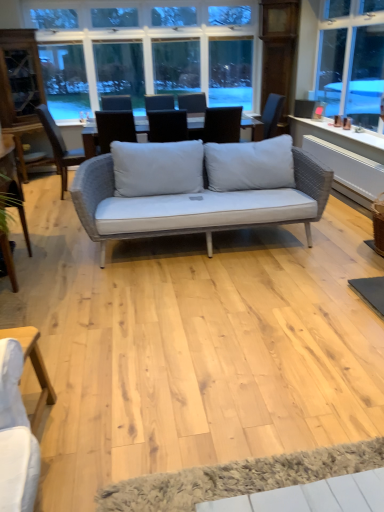
Question: Should I look upward or downward to see clear glass window at upper center?

Choices:
 (A) up
 (B) down

Answer: (A)

Question: Does woven fabric chair at center, which is counted as the first chair, starting from the left, have a greater height compared to matte gray cushion at center, arranged as the 1th chair when viewed from the right?

Choices:
 (A) no
 (B) yes

Answer: (B)

Question: Can you confirm if woven fabric chair at center, which is counted as the first chair, starting from the left, is wider than matte gray cushion at center, the 2th chair viewed from the left?

Choices:
 (A) yes
 (B) no

Answer: (A)

Question: Is woven fabric chair at center, positioned as the second chair in right-to-left order, thinner than matte gray cushion at center, arranged as the 1th chair when viewed from the right?

Choices:
 (A) no
 (B) yes

Answer: (A)

Question: Can you confirm if woven fabric chair at center, which is counted as the first chair, starting from the left, is shorter than matte gray cushion at center, the 2th chair viewed from the left?

Choices:
 (A) no
 (B) yes

Answer: (A)

Question: Considering the relative positions of woven fabric chair at center, which is counted as the first chair, starting from the left, and matte gray cushion at center, arranged as the 1th chair when viewed from the right, in the image provided, is woven fabric chair at center, which is counted as the first chair, starting from the left, to the right of matte gray cushion at center, arranged as the 1th chair when viewed from the right, from the viewer's perspective?

Choices:
 (A) no
 (B) yes

Answer: (A)

Question: Is woven fabric chair at center, positioned as the second chair in right-to-left order, completely or partially outside of matte gray cushion at center, arranged as the 1th chair when viewed from the right?

Choices:
 (A) no
 (B) yes

Answer: (B)

Question: From a real-world perspective, is woven fabric chair at center, positioned as the second chair in right-to-left order, located higher than light wood table at lower left?

Choices:
 (A) yes
 (B) no

Answer: (A)

Question: Can you confirm if woven fabric chair at center, which is counted as the first chair, starting from the left, is smaller than light wood table at lower left?

Choices:
 (A) yes
 (B) no

Answer: (B)

Question: Does woven fabric chair at center, positioned as the second chair in right-to-left order, appear on the right side of light wood table at lower left?

Choices:
 (A) no
 (B) yes

Answer: (A)

Question: Is woven fabric chair at center, positioned as the second chair in right-to-left order, aimed at light wood table at lower left?

Choices:
 (A) yes
 (B) no

Answer: (B)

Question: Is woven fabric chair at center, positioned as the second chair in right-to-left order, closer to camera compared to light wood table at lower left?

Choices:
 (A) yes
 (B) no

Answer: (B)

Question: Is woven fabric chair at center, positioned as the second chair in right-to-left order, to the left of light wood table at lower left from the viewer's perspective?

Choices:
 (A) yes
 (B) no

Answer: (A)

Question: Does light wood table at lower left have a lesser width compared to white textured yoga mat at lower center?

Choices:
 (A) yes
 (B) no

Answer: (B)